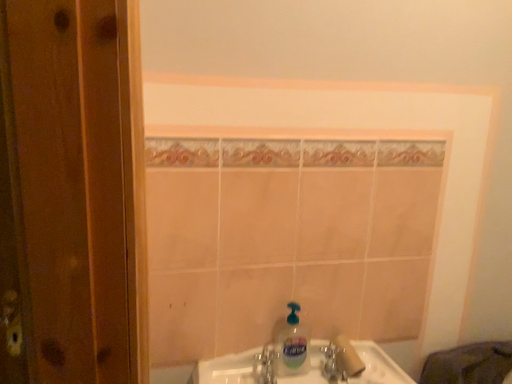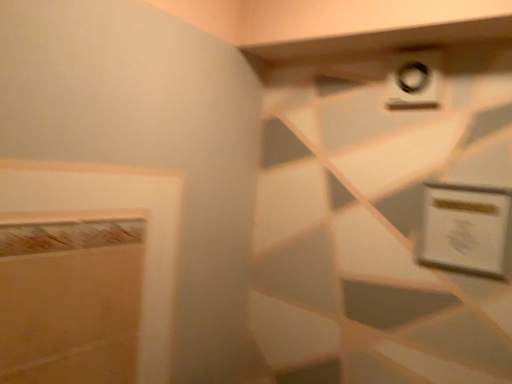
Question: Which way did the camera rotate in the video?

Choices:
 (A) rotated downward
 (B) rotated upward

Answer: (B)